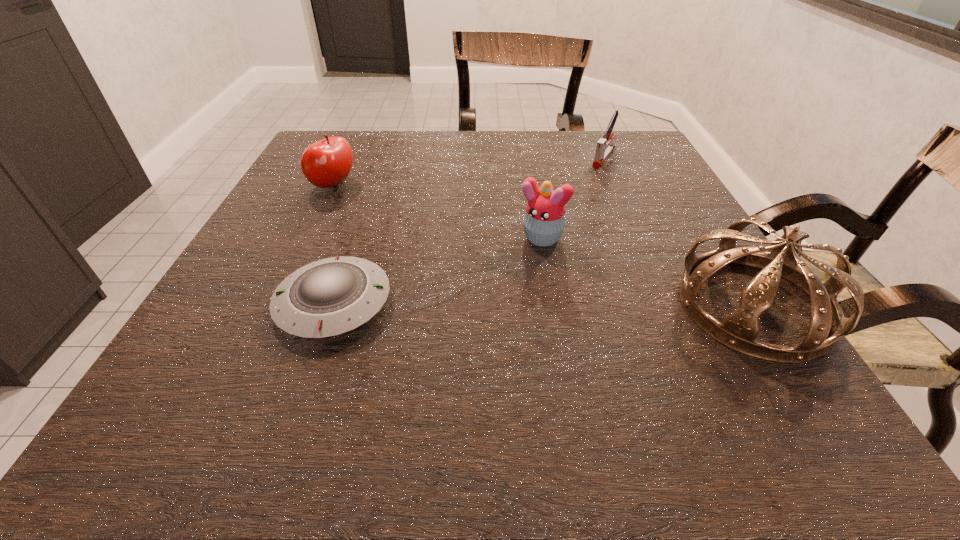
Image resolution: width=960 pixels, height=540 pixels. I want to click on saucer that is at the near edge, so click(x=326, y=298).

Where is `tiara that is positioned at the near edge`? The height and width of the screenshot is (540, 960). tiara that is positioned at the near edge is located at coordinates click(x=738, y=331).

This screenshot has height=540, width=960. I want to click on saucer at the left edge, so click(x=326, y=298).

The image size is (960, 540). I want to click on apple at the left edge, so (x=326, y=163).

You are a GUI agent. You are given a task and a screenshot of the screen. Output one action in this format:
    pyautogui.click(x=<x>, y=<y>)
    Task: Click on the tiara situated at the right edge
    
    Given the screenshot: What is the action you would take?
    pyautogui.click(x=738, y=331)

Where is `stapler that is at the right edge`? stapler that is at the right edge is located at coordinates (604, 148).

Where is `object at the far left corner`? object at the far left corner is located at coordinates (326, 163).

Where is `object that is at the near left corner`? object that is at the near left corner is located at coordinates (326, 298).

Image resolution: width=960 pixels, height=540 pixels. In order to click on object at the far right corner in this screenshot , I will do `click(604, 148)`.

Where is `object that is at the near right corner`? object that is at the near right corner is located at coordinates tap(738, 331).